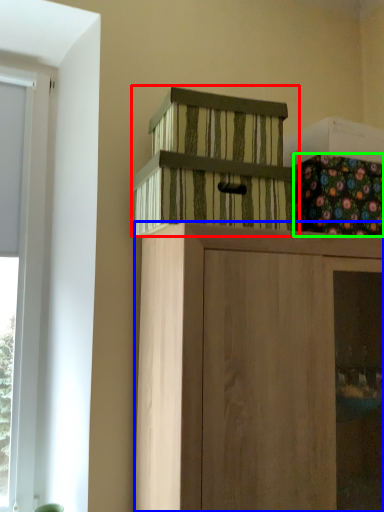
Question: Based on their relative distances, which object is farther from cabinetry (highlighted by a red box)? Choose from cabinetry (highlighted by a blue box) and flower (highlighted by a green box).

Choices:
 (A) cabinetry
 (B) flower

Answer: (A)